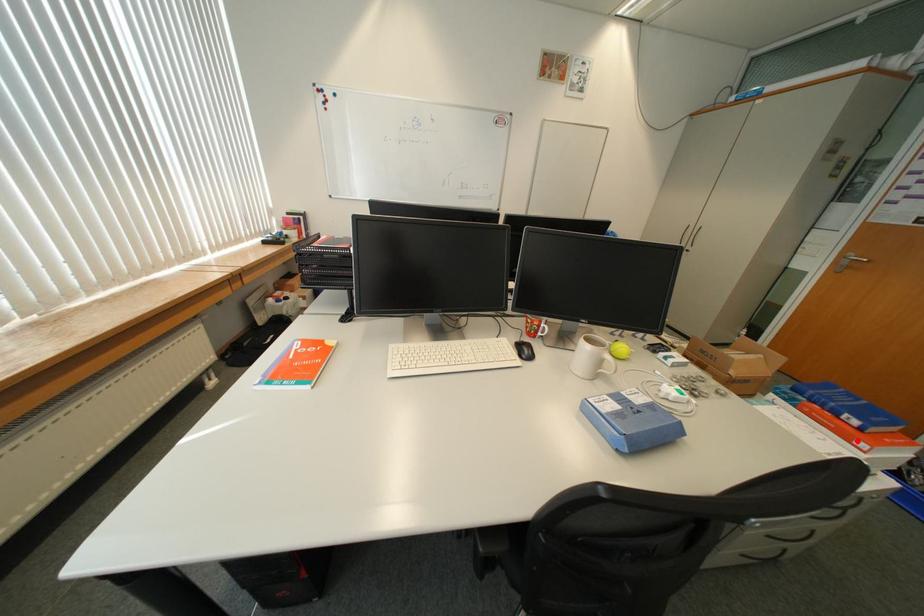
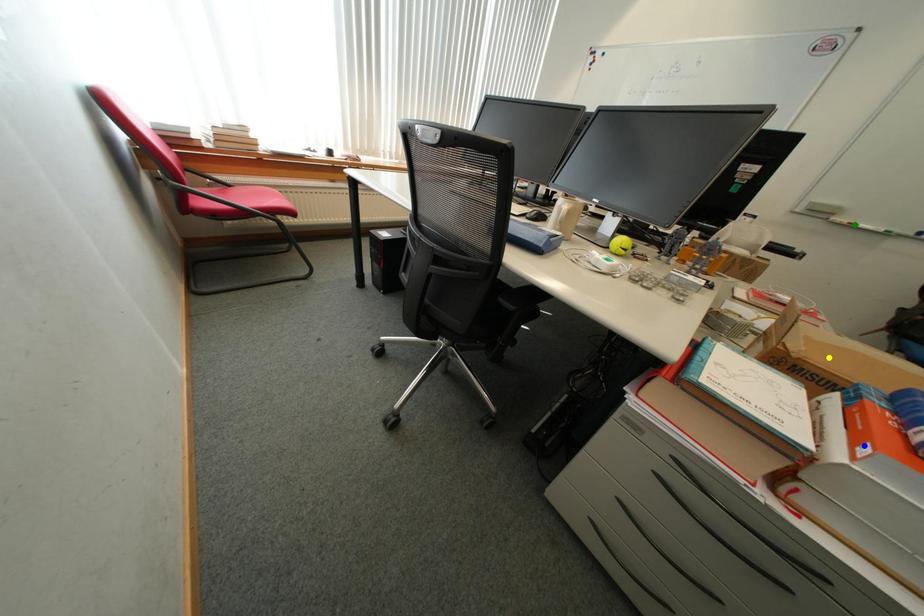
Question: I am providing you with two images of the same scene from different viewpoints. A red point is marked on the first image. You are given multiple points on the second image. Which mark in image 2 goes with the point in image 1?

Choices:
 (A) yellow point
 (B) blue point
 (C) green point

Answer: (B)